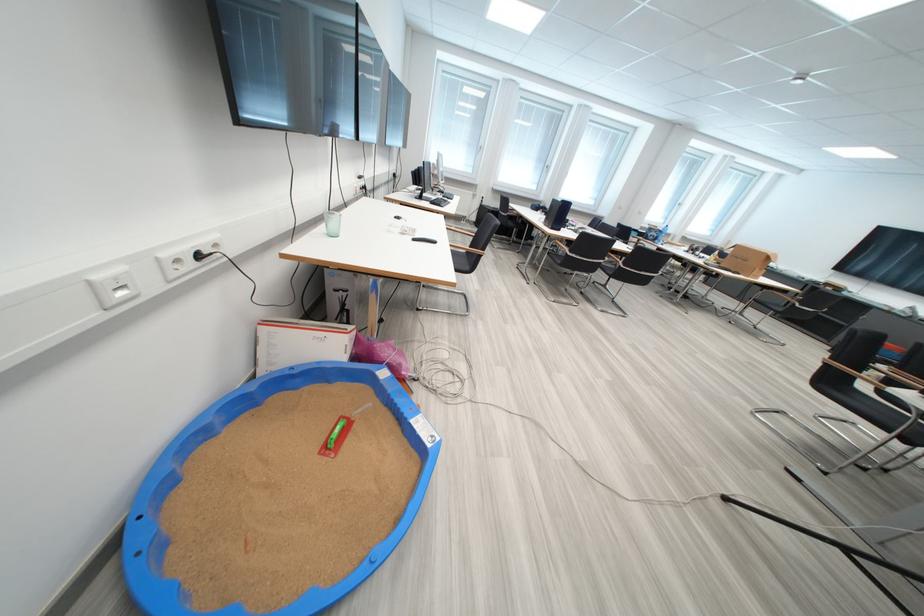
What do you see at coordinates (332, 223) in the screenshot? I see `the blue water bottle` at bounding box center [332, 223].